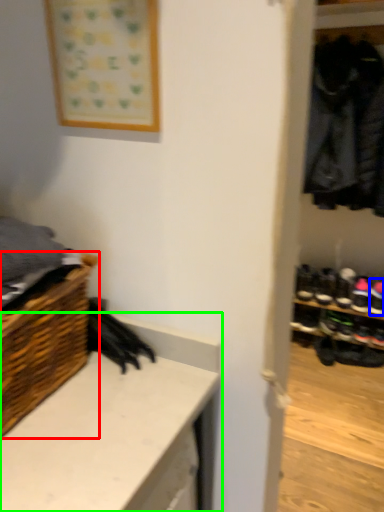
Question: Based on their relative distances, which object is farther from shelf (highlighted by a red box)? Choose from footwear (highlighted by a blue box) and counter (highlighted by a green box).

Choices:
 (A) footwear
 (B) counter

Answer: (A)